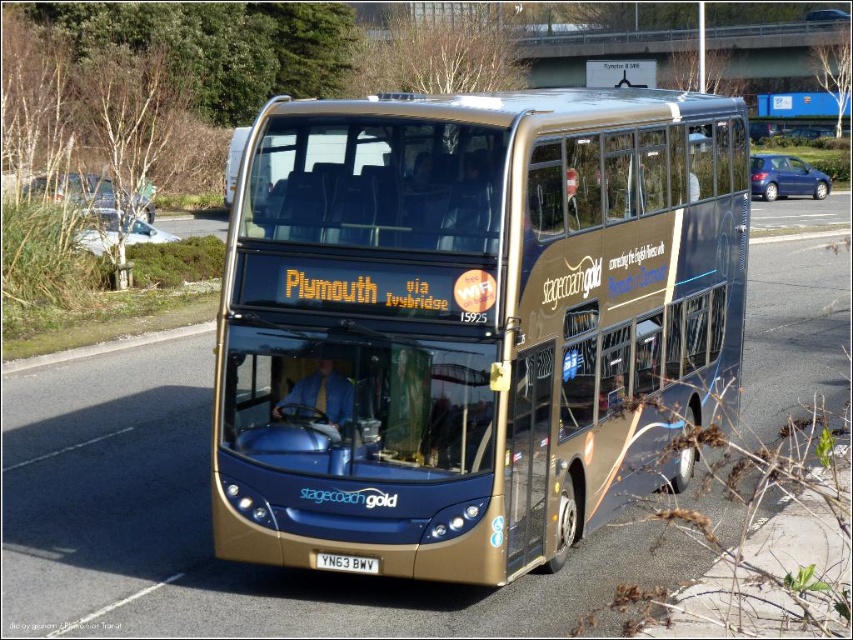
Question: From the image, what is the correct spatial relationship of gold metallic bus at center in relation to red metallic license plate at center?

Choices:
 (A) right
 (B) left

Answer: (B)

Question: Is gold metallic bus at center positioned behind red metallic license plate at center?

Choices:
 (A) yes
 (B) no

Answer: (B)

Question: Which of the following is the farthest from the observer?

Choices:
 (A) gold metallic bus at center
 (B) red metallic license plate at center

Answer: (B)

Question: Among these objects, which one is farthest from the camera?

Choices:
 (A) gold metallic bus at center
 (B) red metallic license plate at center

Answer: (B)

Question: Which point is closer to the camera?

Choices:
 (A) pyautogui.click(x=428, y=401)
 (B) pyautogui.click(x=343, y=564)

Answer: (A)

Question: Is gold metallic bus at center wider than red metallic license plate at center?

Choices:
 (A) yes
 (B) no

Answer: (A)